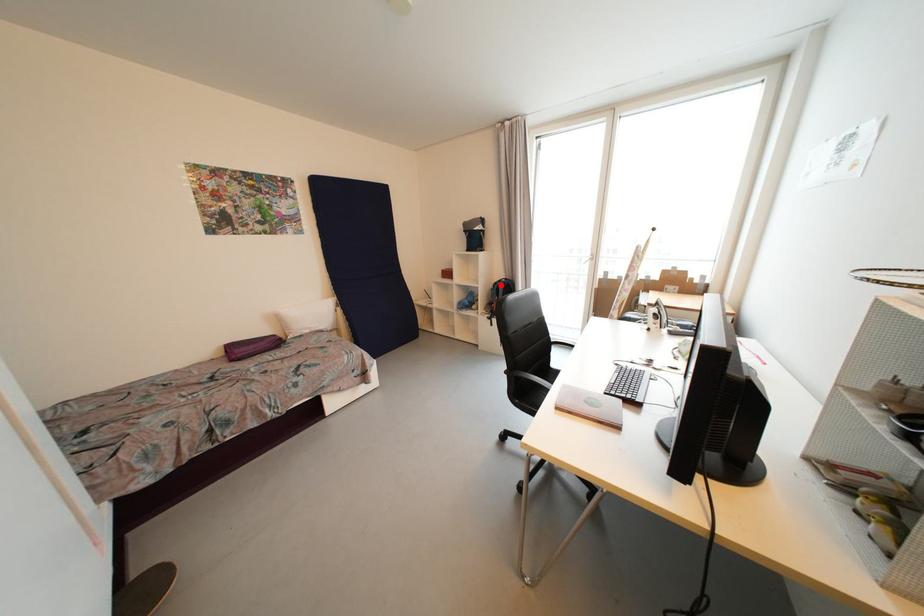
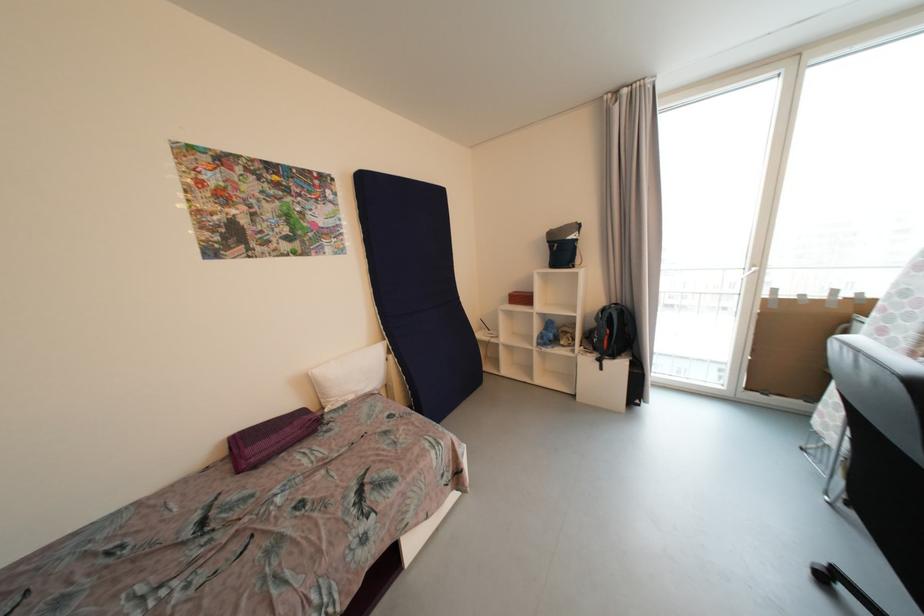
Where in the second image is the point corresponding to the highlighted location from the first image?

(608, 312)